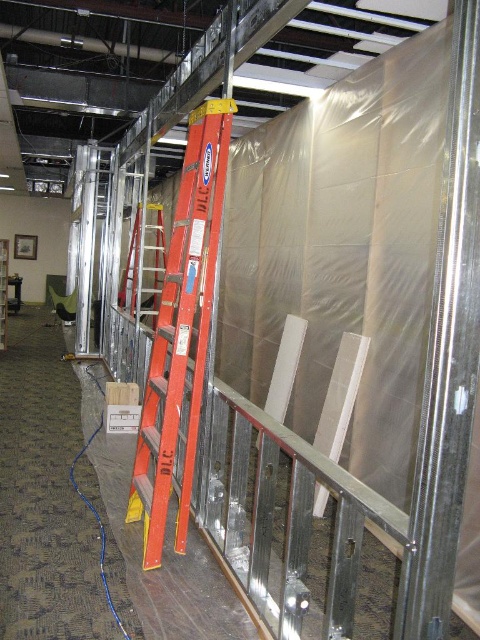
Is point (177, 205) farther from viewer compared to point (146, 209)?

No, (177, 205) is in front of (146, 209).

Which is above, orange aluminum ladder at center or orange fiberglass ladder at center?

orange fiberglass ladder at center is above.

Does point (189, 506) lie behind point (162, 282)?

No, (189, 506) is closer to viewer.

The height and width of the screenshot is (640, 480). What are the coordinates of `orange aluminum ladder at center` in the screenshot? It's located at (181, 332).